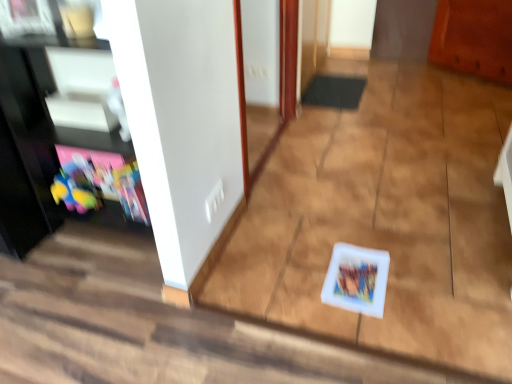
The image size is (512, 384). I want to click on vacant space in front of black rubber doormat at center, so click(x=348, y=122).